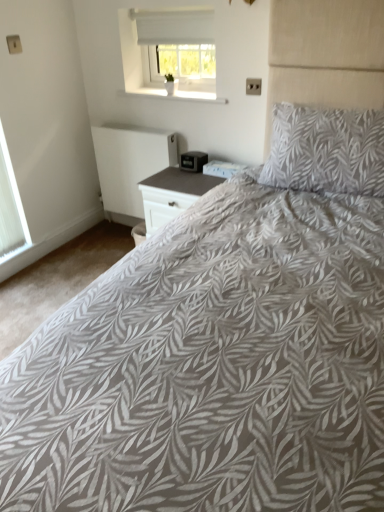
Locate an element on the screen. white matte radiator at lower left is located at coordinates (129, 165).

The width and height of the screenshot is (384, 512). What are the coordinates of `white textured window at left, which is the 1th window in bottom-to-top order` in the screenshot? It's located at (10, 206).

What do you see at coordinates (326, 150) in the screenshot? I see `gray leaf-patterned pillow at upper right` at bounding box center [326, 150].

Locate an element on the screen. Image resolution: width=384 pixels, height=512 pixels. white matte window at upper center, which is the first window from top to bottom is located at coordinates (170, 52).

Between white matte radiator at lower left and gray leaf-patterned pillow at upper right, which one is positioned behind?

Positioned behind is white matte radiator at lower left.

From their relative heights in the image, would you say white matte radiator at lower left is taller or shorter than gray leaf-patterned pillow at upper right?

white matte radiator at lower left is taller than gray leaf-patterned pillow at upper right.

Would you say white matte radiator at lower left contains gray leaf-patterned pillow at upper right?

No.

Is white matte radiator at lower left positioned far away from gray leaf-patterned pillow at upper right?

Absolutely, white matte radiator at lower left is distant from gray leaf-patterned pillow at upper right.

Can you confirm if gray leaf-patterned pillow at upper right is positioned to the right of white matte radiator at lower left?

Yes, gray leaf-patterned pillow at upper right is to the right of white matte radiator at lower left.

From a real-world perspective, is gray leaf-patterned pillow at upper right located beneath white matte radiator at lower left?

No.

From the picture: From the image's perspective, which one is positioned lower, gray leaf-patterned pillow at upper right or white matte radiator at lower left?

white matte radiator at lower left is shown below in the image.

Measure the distance between gray leaf-patterned pillow at upper right and white matte radiator at lower left.

gray leaf-patterned pillow at upper right is 3.55 feet away from white matte radiator at lower left.

From a real-world perspective, is white matte window at upper center, arranged as the 1th window when viewed from the right, positioned under white matte radiator at lower left based on gravity?

No.

Can you confirm if white matte window at upper center, arranged as the 1th window when viewed from the right, is shorter than white matte radiator at lower left?

Yes.

From the picture: Is white matte window at upper center, arranged as the 1th window when viewed from the right, oriented away from white matte radiator at lower left?

No, white matte window at upper center, arranged as the 1th window when viewed from the right,'s orientation is not away from white matte radiator at lower left.

Is white matte window at upper center, which is counted as the second window, starting from the bottom, not near white matte radiator at lower left?

No, white matte window at upper center, which is counted as the second window, starting from the bottom, is in close proximity to white matte radiator at lower left.

Based on the photo, between white textured window at left, which is the 1th window in bottom-to-top order, and white matte window at upper center, which is counted as the second window, starting from the bottom, which one has smaller width?

white textured window at left, which is the 1th window in bottom-to-top order, is thinner.

From the image's perspective, does white textured window at left, positioned as the second window in right-to-left order, appear lower than white matte window at upper center, the second window viewed from the left?

Yes.

Does point (2, 159) come behind point (188, 81)?

No, (2, 159) is in front of (188, 81).

Which of these two, white textured window at left, the 2th window from the top, or white matte window at upper center, arranged as the 1th window when viewed from the right, stands shorter?

With less height is white matte window at upper center, arranged as the 1th window when viewed from the right.

Is white matte radiator at lower left situated inside white matte window at upper center, arranged as the 1th window when viewed from the right, or outside?

white matte radiator at lower left is not enclosed by white matte window at upper center, arranged as the 1th window when viewed from the right.

From a real-world perspective, which is physically above, white matte radiator at lower left or white matte window at upper center, arranged as the 1th window when viewed from the right?

From a 3D spatial view, white matte window at upper center, arranged as the 1th window when viewed from the right, is above.

Considering the relative positions of white matte radiator at lower left and white matte window at upper center, which is the first window from top to bottom, in the image provided, is white matte radiator at lower left behind white matte window at upper center, which is the first window from top to bottom,?

Yes, the depth of white matte radiator at lower left is greater than that of white matte window at upper center, which is the first window from top to bottom.

Looking at this image, is white matte window at upper center, which is counted as the second window, starting from the bottom, not inside gray leaf-patterned pillow at upper right?

Yes.

From a real-world perspective, is white matte window at upper center, which is counted as the second window, starting from the bottom, located beneath gray leaf-patterned pillow at upper right?

Incorrect, from a real-world perspective, white matte window at upper center, which is counted as the second window, starting from the bottom, is higher than gray leaf-patterned pillow at upper right.

Considering the sizes of white matte window at upper center, arranged as the 1th window when viewed from the right, and gray leaf-patterned pillow at upper right in the image, is white matte window at upper center, arranged as the 1th window when viewed from the right, wider or thinner than gray leaf-patterned pillow at upper right?

In the image, white matte window at upper center, arranged as the 1th window when viewed from the right, appears to be more narrow than gray leaf-patterned pillow at upper right.

From the image's perspective, is white matte window at upper center, the second window viewed from the left, on top of gray leaf-patterned pillow at upper right?

Yes.

The image size is (384, 512). In order to click on pillow below the white matte window at upper center, the second window viewed from the left (from the image's perspective) in this screenshot , I will do `click(326, 150)`.

Can you confirm if gray leaf-patterned pillow at upper right is positioned to the left of white matte window at upper center, arranged as the 1th window when viewed from the right?

In fact, gray leaf-patterned pillow at upper right is to the right of white matte window at upper center, arranged as the 1th window when viewed from the right.

Could you tell me if gray leaf-patterned pillow at upper right is facing white matte window at upper center, which is the first window from top to bottom?

No, gray leaf-patterned pillow at upper right is not turned towards white matte window at upper center, which is the first window from top to bottom.

Is the surface of gray leaf-patterned pillow at upper right in direct contact with white matte window at upper center, which is counted as the second window, starting from the bottom?

No, gray leaf-patterned pillow at upper right is not touching white matte window at upper center, which is counted as the second window, starting from the bottom.

You are a GUI agent. You are given a task and a screenshot of the screen. Output one action in this format:
    pyautogui.click(x=<x>, y=<y>)
    Task: Click on the radiator below the gray leaf-patterned pillow at upper right (from the image's perspective)
    The image size is (384, 512).
    Given the screenshot: What is the action you would take?
    pyautogui.click(x=129, y=165)

You are a GUI agent. You are given a task and a screenshot of the screen. Output one action in this format:
    pyautogui.click(x=<x>, y=<y>)
    Task: Click on the pillow located on the right of white matte radiator at lower left
    Image resolution: width=384 pixels, height=512 pixels.
    Given the screenshot: What is the action you would take?
    pyautogui.click(x=326, y=150)

From the image, which object appears to be nearer to white matte radiator at lower left, white matte window at upper center, which is counted as the second window, starting from the bottom, or gray leaf-patterned pillow at upper right?

white matte window at upper center, which is counted as the second window, starting from the bottom, is closer to white matte radiator at lower left.

Estimate the real-world distances between objects in this image. Which object is further from gray leaf-patterned pillow at upper right, white matte radiator at lower left or white textured window at left, which is the 1th window in bottom-to-top order?

white textured window at left, which is the 1th window in bottom-to-top order, lies further to gray leaf-patterned pillow at upper right than the other object.

From the image, which object appears to be nearer to white textured window at left, the first window in the left-to-right sequence, white matte radiator at lower left or white matte window at upper center, the second window viewed from the left?

Among the two, white matte radiator at lower left is located nearer to white textured window at left, the first window in the left-to-right sequence.

When comparing their distances from gray leaf-patterned pillow at upper right, does white textured window at left, the 2th window from the top, or white matte window at upper center, arranged as the 1th window when viewed from the right, seem closer?

white matte window at upper center, arranged as the 1th window when viewed from the right, lies closer to gray leaf-patterned pillow at upper right than the other object.

Estimate the real-world distances between objects in this image. Which object is further from white matte radiator at lower left, gray leaf-patterned pillow at upper right or white textured window at left, positioned as the second window in right-to-left order?

Based on the image, gray leaf-patterned pillow at upper right appears to be further to white matte radiator at lower left.

Which object lies further to the anchor point white matte window at upper center, arranged as the 1th window when viewed from the right, gray leaf-patterned pillow at upper right or white matte radiator at lower left?

gray leaf-patterned pillow at upper right is positioned further to the anchor white matte window at upper center, arranged as the 1th window when viewed from the right.

Based on their spatial positions, is white matte radiator at lower left or gray leaf-patterned pillow at upper right further from white textured window at left, positioned as the second window in right-to-left order?

The object further to white textured window at left, positioned as the second window in right-to-left order, is gray leaf-patterned pillow at upper right.

Estimate the real-world distances between objects in this image. Which object is further from white matte radiator at lower left, white textured window at left, positioned as the second window in right-to-left order, or white matte window at upper center, arranged as the 1th window when viewed from the right?

white textured window at left, positioned as the second window in right-to-left order, lies further to white matte radiator at lower left than the other object.

Identify the location of radiator between white textured window at left, positioned as the second window in right-to-left order, and white matte window at upper center, which is the first window from top to bottom, in the horizontal direction. Image resolution: width=384 pixels, height=512 pixels. pos(129,165).

This screenshot has width=384, height=512. Find the location of `window between white matte radiator at lower left and gray leaf-patterned pillow at upper right`. window between white matte radiator at lower left and gray leaf-patterned pillow at upper right is located at coordinates (170, 52).

I want to click on window situated between white textured window at left, positioned as the second window in right-to-left order, and gray leaf-patterned pillow at upper right from left to right, so click(170, 52).

Where is `radiator located between white textured window at left, which is the 1th window in bottom-to-top order, and gray leaf-patterned pillow at upper right in the left-right direction`? The width and height of the screenshot is (384, 512). radiator located between white textured window at left, which is the 1th window in bottom-to-top order, and gray leaf-patterned pillow at upper right in the left-right direction is located at coordinates (129, 165).